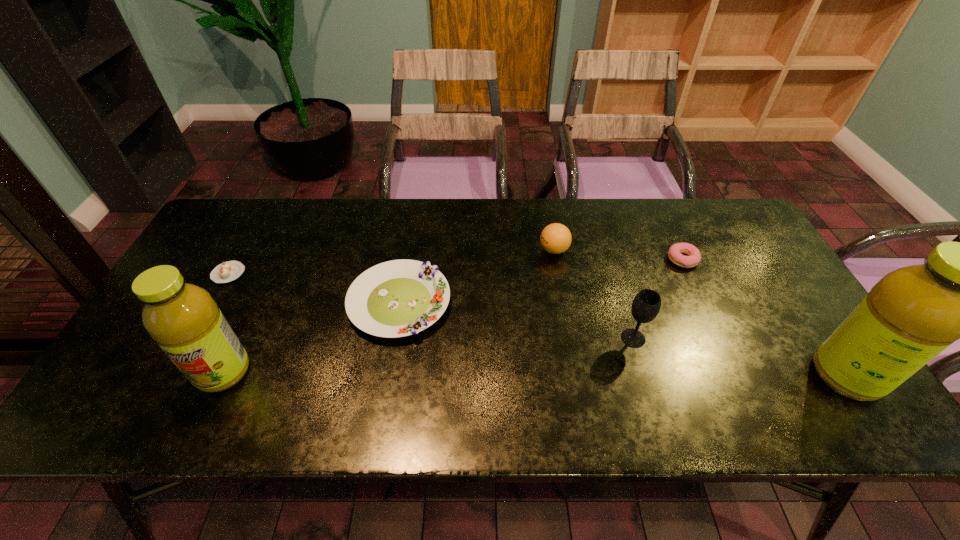
The image size is (960, 540). I want to click on free spot between the cupcake and the tallest object, so click(538, 325).

Where is `empty space that is in between the fifth object from left to right and the sixth object from right to left`? empty space that is in between the fifth object from left to right and the sixth object from right to left is located at coordinates (428, 355).

Locate an element on the screen. The image size is (960, 540). unoccupied area between the doughnut and the second tallest object is located at coordinates (453, 316).

The image size is (960, 540). Identify the location of vacant area between the doughnut and the third object from left to right. (541, 281).

Where is `empty location between the third tallest object and the salad plate`? The height and width of the screenshot is (540, 960). empty location between the third tallest object and the salad plate is located at coordinates (516, 320).

Identify the location of empty space that is in between the wineglass and the salad plate. This screenshot has height=540, width=960. (516, 320).

Find the location of a particular element. The image size is (960, 540). object that is the sixth closest to the third object from left to right is located at coordinates point(912,314).

Locate which object ranks in proximity to the tallest object. Please provide its 2D coordinates. Your answer should be formatted as a tuple, i.e. [(x, y)], where the tuple contains the x and y coordinates of a point satisfying the conditions above.

[(694, 257)]

The width and height of the screenshot is (960, 540). Find the location of `vacant space that satisfies the following two spatial constraints: 1. on the side with brand of the fourth tallest object; 2. on the front side of the salad plate`. vacant space that satisfies the following two spatial constraints: 1. on the side with brand of the fourth tallest object; 2. on the front side of the salad plate is located at coordinates (564, 302).

At what (x,y) coordinates should I click in order to perform the action: click on free location that satisfies the following two spatial constraints: 1. on the side with brand of the fourth object from right to left; 2. on the left side of the fifth object from left to right. Please return your answer as a coordinate pair (x, y). Image resolution: width=960 pixels, height=540 pixels. Looking at the image, I should click on (569, 338).